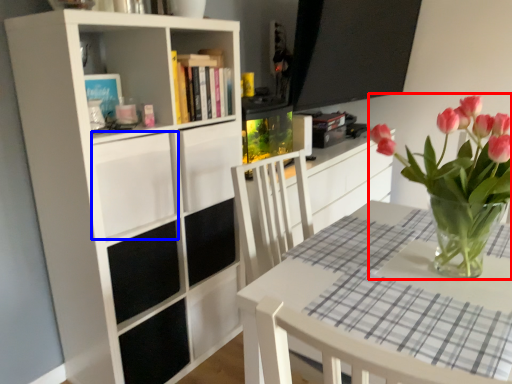
Question: Which point is further to the camera, houseplant (highlighted by a red box) or drawer (highlighted by a blue box)?

Choices:
 (A) houseplant
 (B) drawer

Answer: (B)